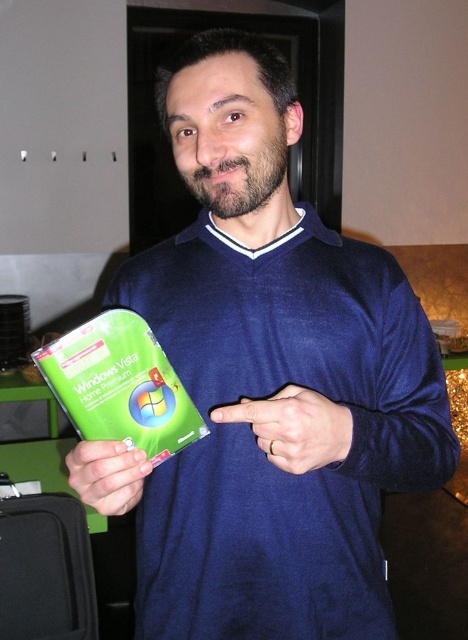
You are a delivery person who needs to place the green plastic windows vista home premium at center into a storage box located at point (119, 385). Can you confirm if the storage box is already at the correct position where the product is currently located?

The green plastic windows vista home premium at center is represented by point (119, 385), so yes, the storage box is already at the correct position where the product is currently located.

You are standing in front of the image and want to determine which of the two points, point (63,396) or point (320,404), is closer to you. Based on the scene description, which point is closer?

Point (63,396) is closer to you because it is further to the viewer than point (320,404) according to the description.